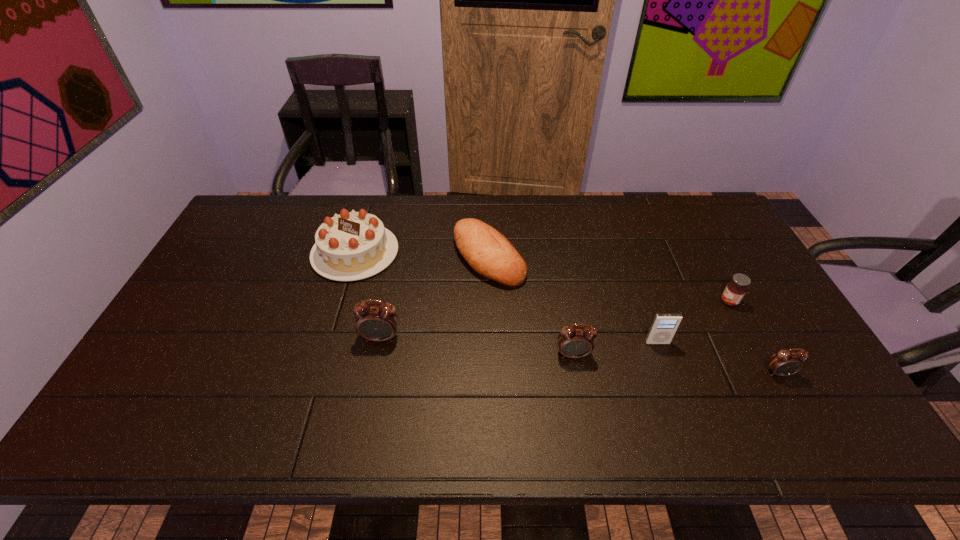
At what (x,y) coordinates should I click in order to perform the action: click on alarm clock that can be found as the second closest to the iPod. Please return your answer as a coordinate pair (x, y). The height and width of the screenshot is (540, 960). Looking at the image, I should click on coord(786,362).

Point out which alarm clock is positioned as the nearest to the rightmost alarm clock. Please provide its 2D coordinates. Your answer should be formatted as a tuple, i.e. [(x, y)], where the tuple contains the x and y coordinates of a point satisfying the conditions above.

[(573, 342)]